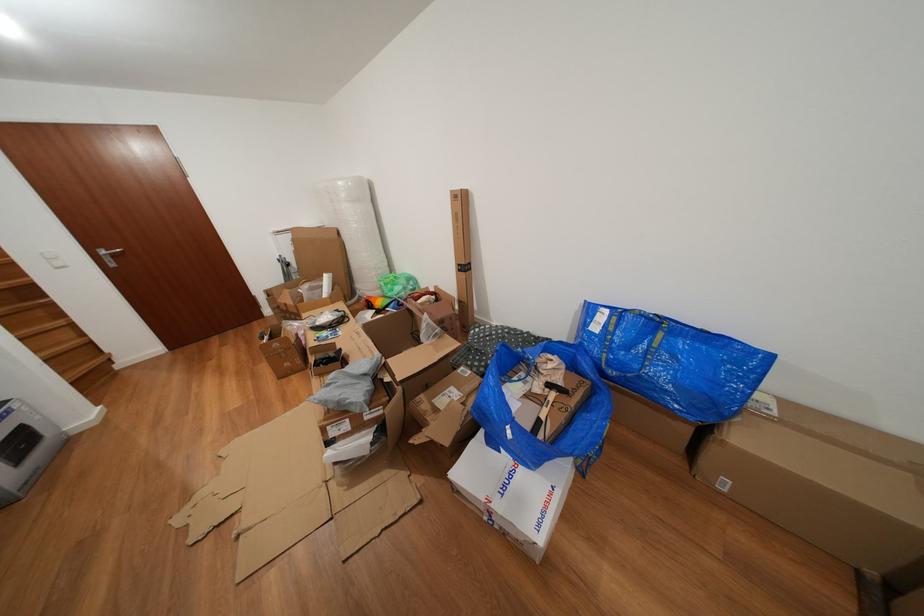
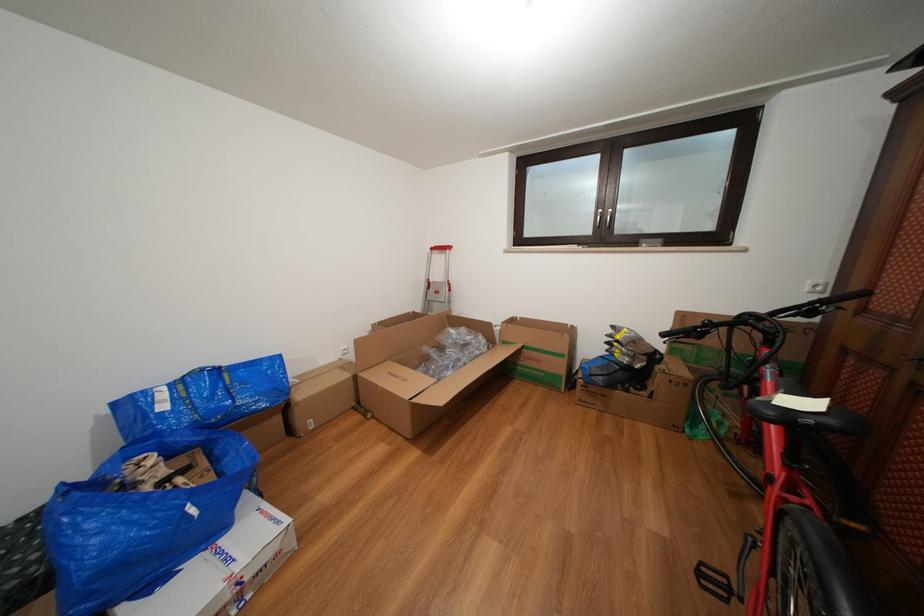
Locate, in the second image, the point that corresponds to [517,438] in the first image.

(201, 516)